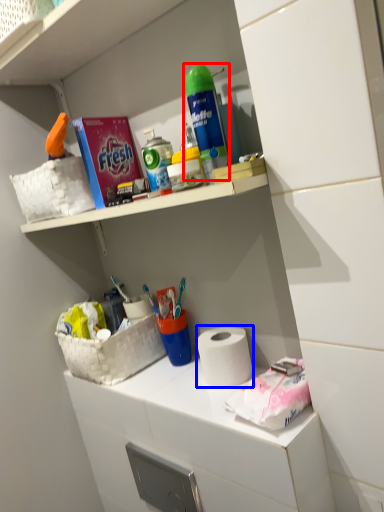
Question: Which point is closer to the camera, cleaning product (highlighted by a red box) or paper towel (highlighted by a blue box)?

Choices:
 (A) cleaning product
 (B) paper towel

Answer: (A)